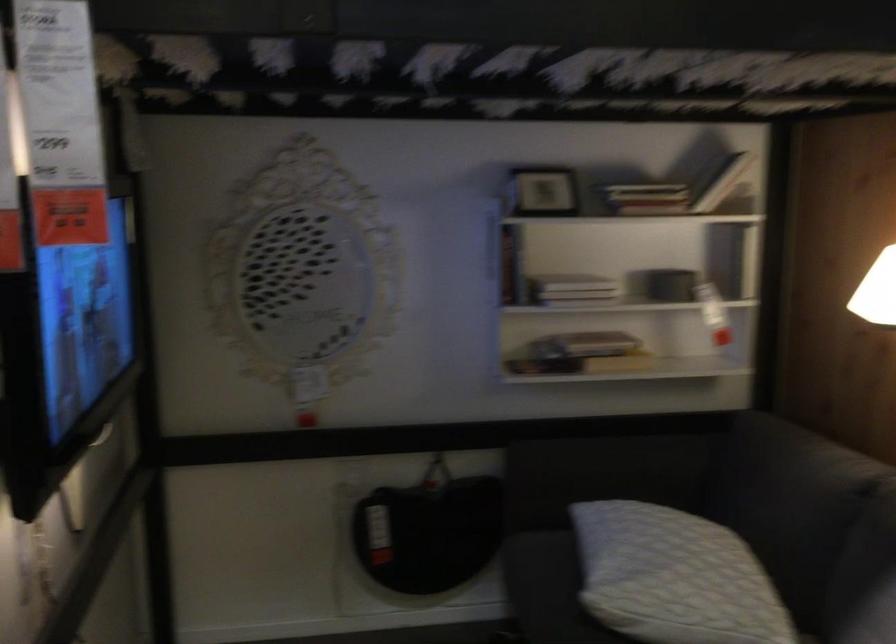
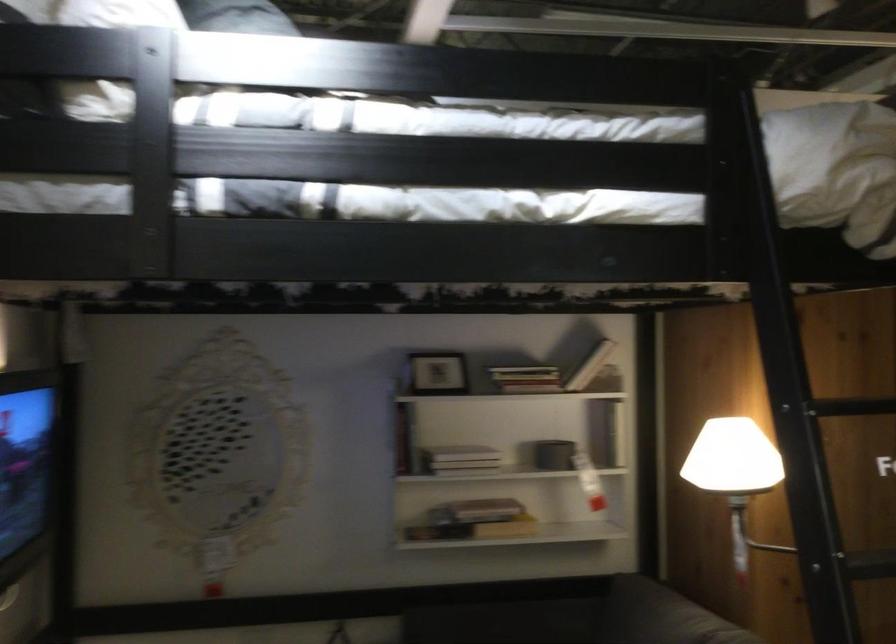
Locate, in the second image, the point that corresponds to (540,187) in the first image.

(437, 373)